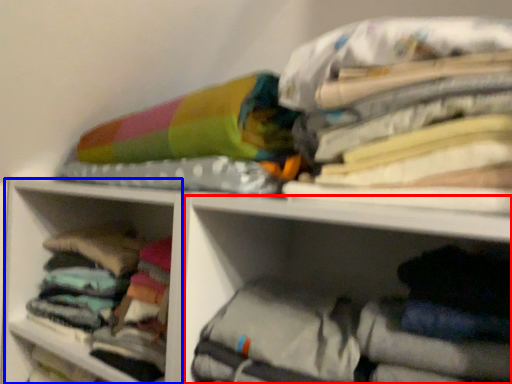
Question: Which point is closer to the camera, cabinet (highlighted by a red box) or cabinet (highlighted by a blue box)?

Choices:
 (A) cabinet
 (B) cabinet

Answer: (A)